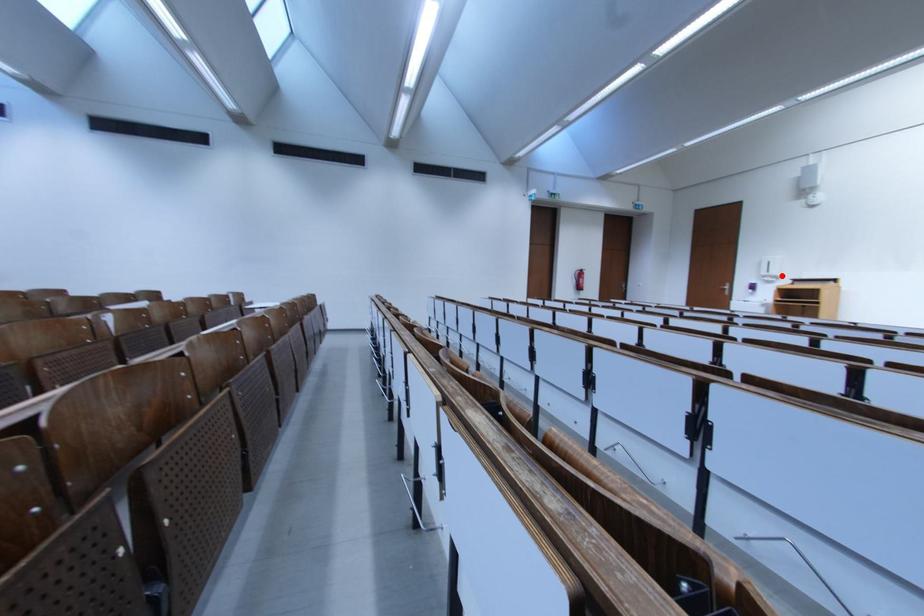
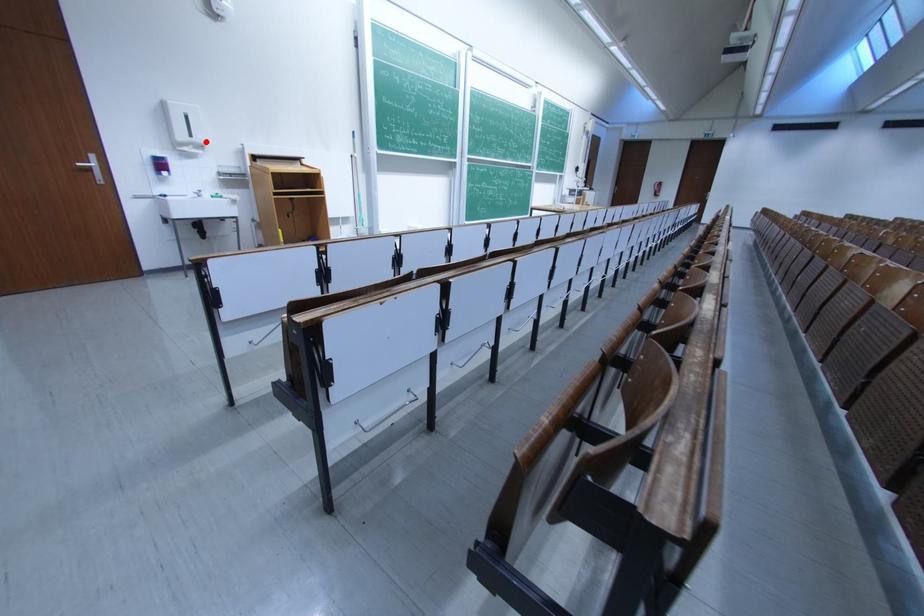
I am providing you with two images of the same scene from different viewpoints. A red point is marked on the first image and another point is marked on the second image. Do the highlighted points in image1 and image2 indicate the same real-world spot?

Yes